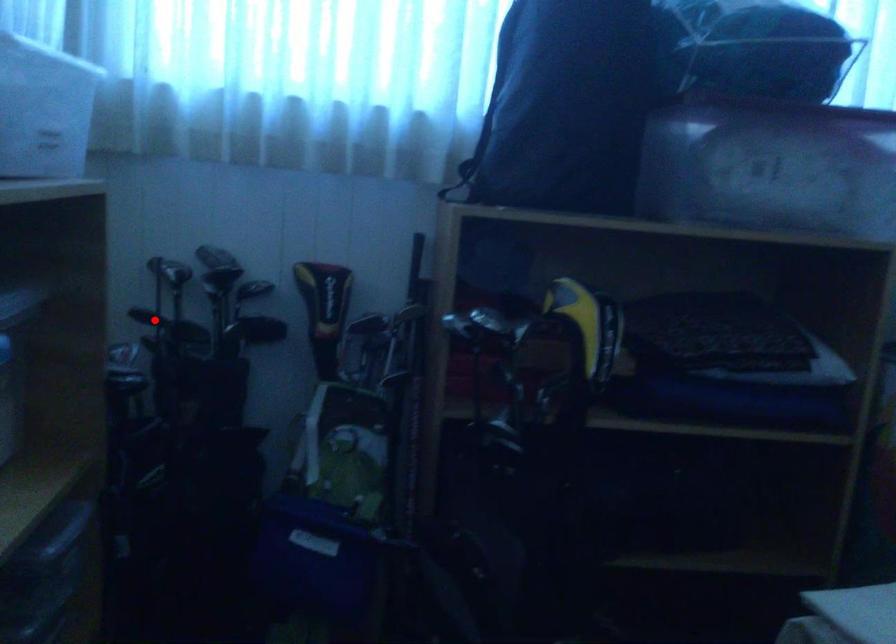
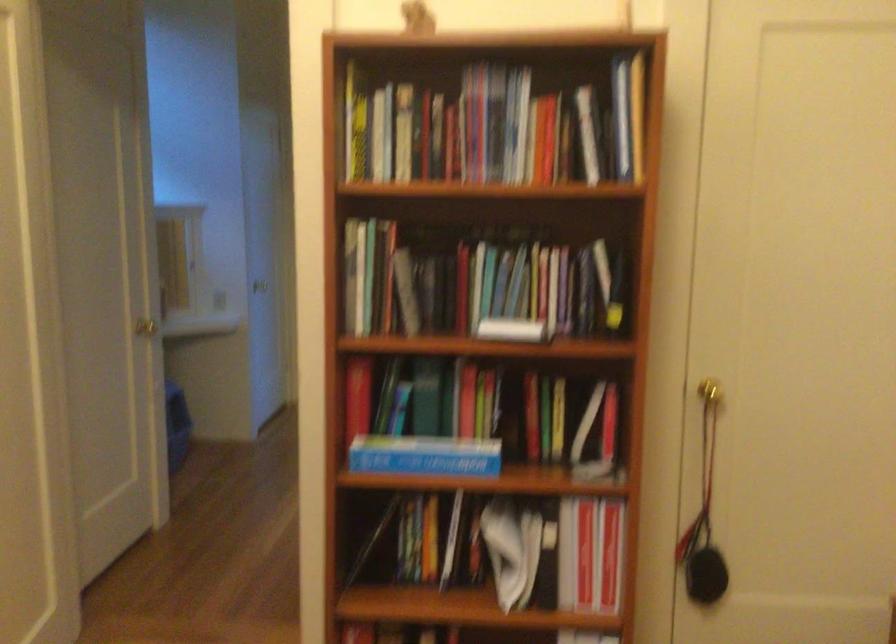
Question: I am providing you with two images of the same scene from different viewpoints. A red point is marked on the first image. Is the red point's position out of view in image 2?

Choices:
 (A) Yes
 (B) No

Answer: (A)